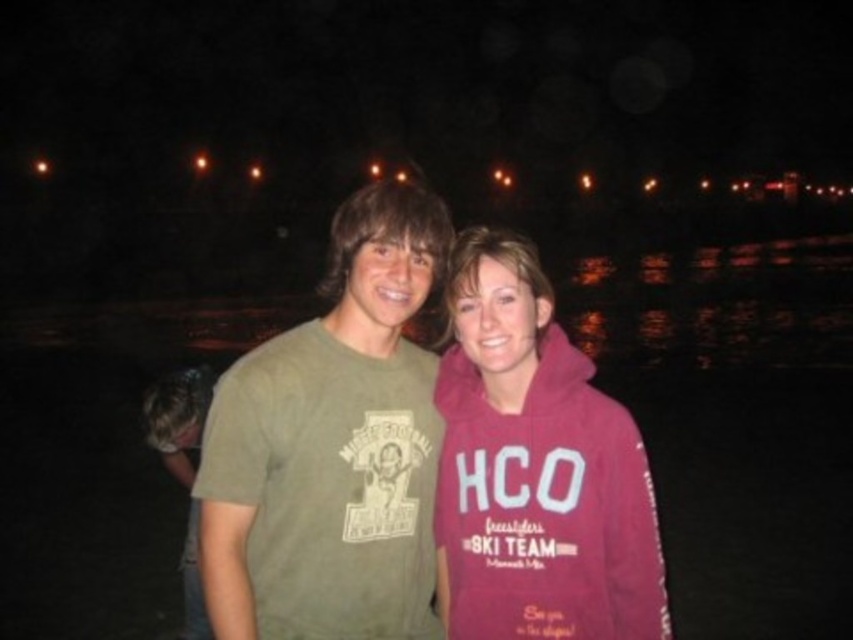
In the scene shown: Does green cotton t-shirt at center appear under green matte t-shirt at lower left?

Actually, green cotton t-shirt at center is above green matte t-shirt at lower left.

Between point (315, 349) and point (148, 435), which one is positioned in front?

Positioned in front is point (315, 349).

Identify the location of green cotton t-shirt at center. (332, 445).

Does pink fleece sweatshirt at center have a lesser width compared to green matte t-shirt at lower left?

No.

The image size is (853, 640). What do you see at coordinates (535, 468) in the screenshot? I see `pink fleece sweatshirt at center` at bounding box center [535, 468].

Is point (448, 508) positioned before point (189, 509)?

Yes, it is in front of point (189, 509).

Identify the location of pink fleece sweatshirt at center. (535, 468).

Can you confirm if green cotton t-shirt at center is smaller than pink fleece sweatshirt at center?

No.

Who is more distant from viewer, (218, 492) or (573, 440)?

The point (573, 440) is behind.

Locate an element on the screen. The image size is (853, 640). green cotton t-shirt at center is located at coordinates (332, 445).